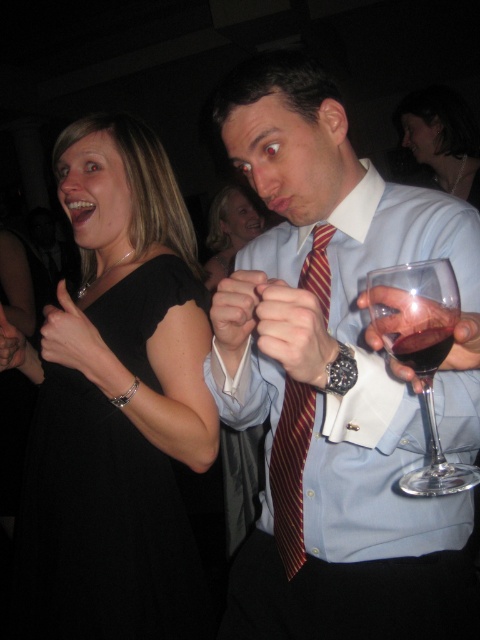
Who is higher up, matte blue shirt at center or maroon striped tie at center?

matte blue shirt at center

Is matte blue shirt at center behind maroon striped tie at center?

No, it is not.

Between point (360, 328) and point (275, 476), which one is positioned in front?

Point (360, 328) is in front.

What are the coordinates of `matte blue shirt at center` in the screenshot? It's located at (332, 378).

Is transparent glass at right wider than black satin dress at upper left?

In fact, transparent glass at right might be narrower than black satin dress at upper left.

Is transparent glass at right closer to camera compared to black satin dress at upper left?

Yes, transparent glass at right is in front of black satin dress at upper left.

I want to click on transparent glass at right, so click(420, 352).

Between transparent glass at right and matte black dress at center, which one is positioned lower?

Positioned lower is transparent glass at right.

Is point (393, 291) behind point (451, 164)?

No, (393, 291) is in front of (451, 164).

Where is `transparent glass at right`? The width and height of the screenshot is (480, 640). transparent glass at right is located at coordinates (420, 352).